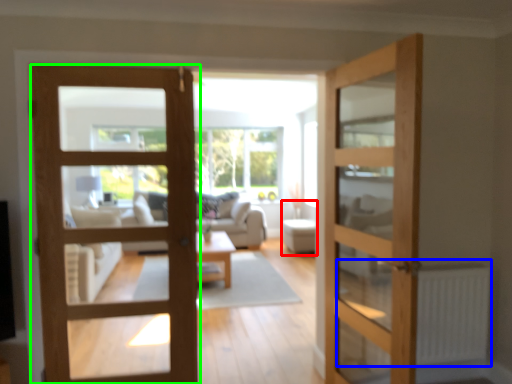
Question: Estimate the real-world distances between objects in this image. Which object is farther from furniture (highlighted by a red box), radiator (highlighted by a blue box) or door (highlighted by a green box)?

Choices:
 (A) radiator
 (B) door

Answer: (B)